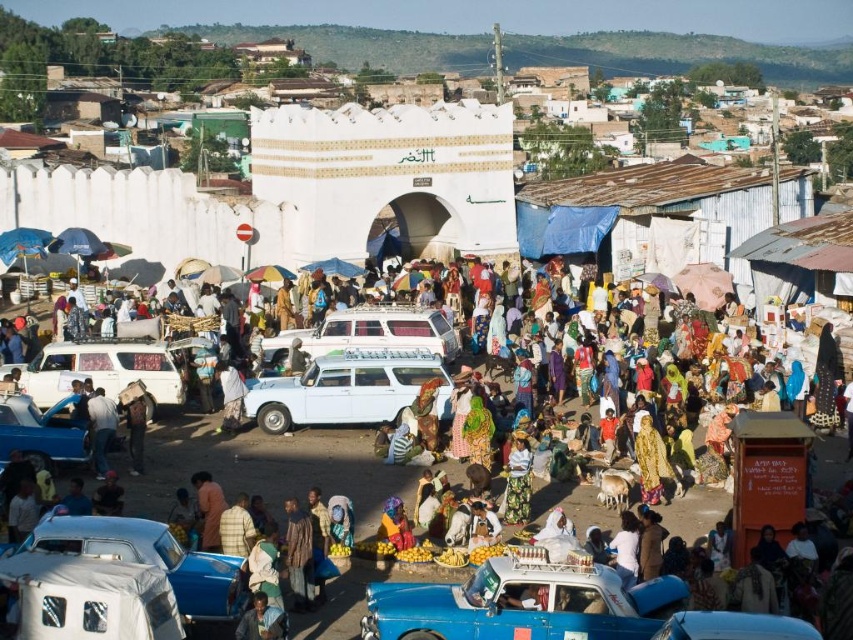
Question: Where is blue metallic car at lower left located in relation to light brown leather jacket at lower left in the image?

Choices:
 (A) right
 (B) left

Answer: (B)

Question: Which point is farther to the camera?

Choices:
 (A) light brown leather jacket at lower left
 (B) dark brown leather jacket at center
 (C) blue metallic car at lower left
 (D) white fabric umbrella at center

Answer: (B)

Question: Which point is farther to the camera?

Choices:
 (A) (33, 406)
 (B) (517, 488)

Answer: (A)

Question: Estimate the real-world distances between objects in this image. Which object is farther from the light brown leather jacket at lower left?

Choices:
 (A) blue metallic car at lower center
 (B) white fabric umbrella at center

Answer: (A)

Question: Can you confirm if white fabric umbrella at center is positioned below blue metallic car at lower center?

Choices:
 (A) yes
 (B) no

Answer: (B)

Question: Does white matte van at center have a greater width compared to white matte van at center-left?

Choices:
 (A) yes
 (B) no

Answer: (A)